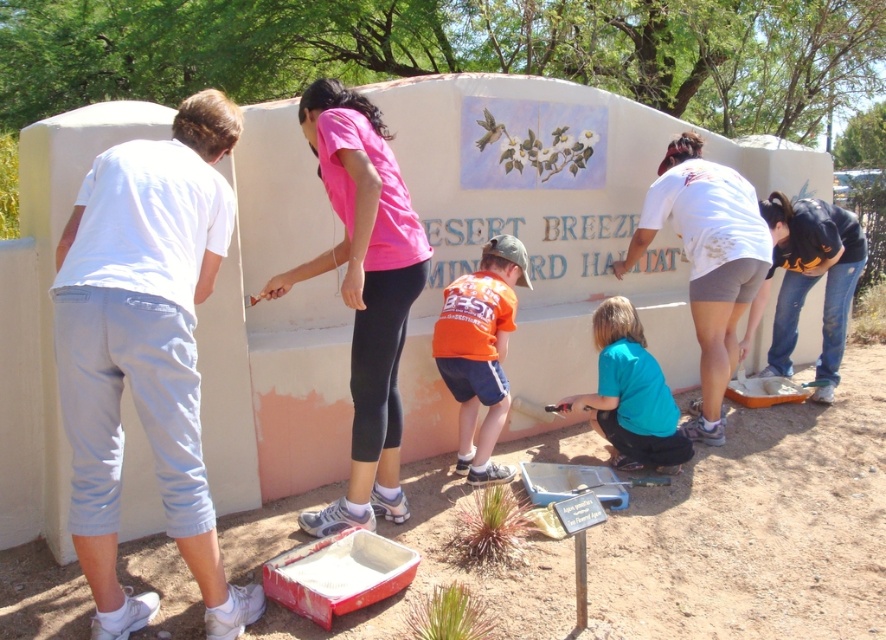
Does orange t-shirt at center have a greater height compared to black fabric shirt at lower right?

In fact, orange t-shirt at center may be shorter than black fabric shirt at lower right.

Who is more forward, (478,337) or (821,250)?

Point (478,337) is more forward.

This screenshot has height=640, width=886. Find the location of `orange t-shirt at center`. orange t-shirt at center is located at coordinates (480, 349).

Who is taller, pink fabric shirt at upper center or white cotton shirt at right?

pink fabric shirt at upper center

Is point (325, 172) positioned after point (640, 256)?

That is False.

Describe the element at coordinates (363, 291) in the screenshot. This screenshot has height=640, width=886. I see `pink fabric shirt at upper center` at that location.

The image size is (886, 640). Identify the location of pink fabric shirt at upper center. (363, 291).

Does white cotton shirt at left have a smaller size compared to black fabric shirt at lower right?

Correct, white cotton shirt at left occupies less space than black fabric shirt at lower right.

Is white cotton shirt at left positioned behind black fabric shirt at lower right?

No, white cotton shirt at left is in front of black fabric shirt at lower right.

Between point (200, 566) and point (767, 368), which one is positioned in front?

Positioned in front is point (200, 566).

I want to click on white cotton shirt at left, so click(145, 352).